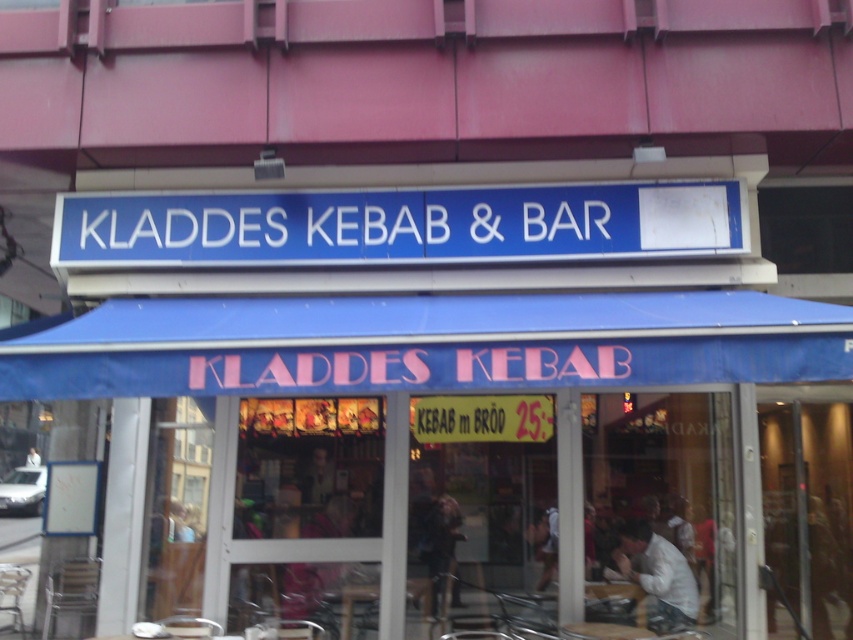
Does blue fabric canopy at center have a greater width compared to blue plastic sign at center?

Yes, blue fabric canopy at center is wider than blue plastic sign at center.

Is point (103, 364) closer to viewer compared to point (585, 250)?

Yes, point (103, 364) is in front of point (585, 250).

Identify the location of blue fabric canopy at center. (427, 344).